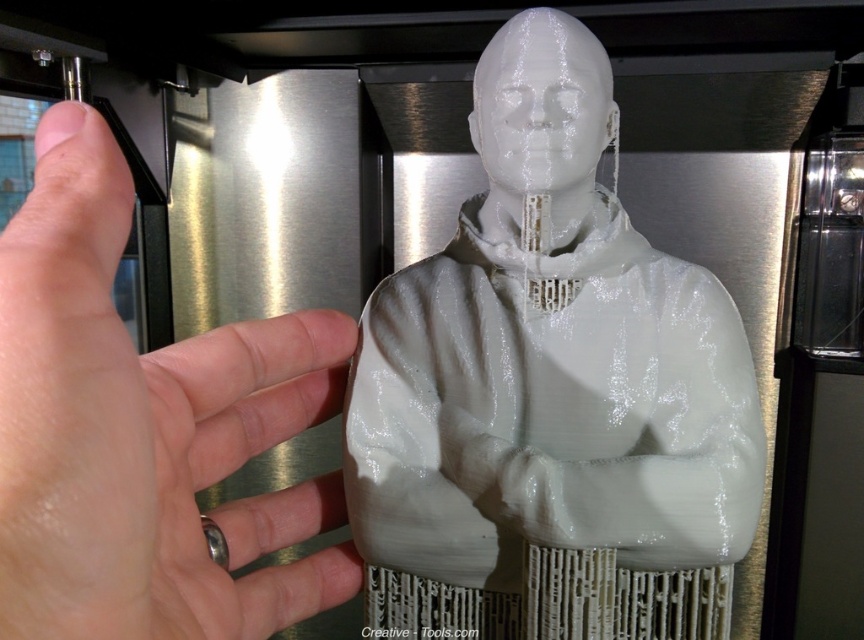
You are an art curator examining a 3D printed sculpture. The sculpture consists of a white glossy bust at center and a white matte hand at upper left. Which object has a greater width?

The white glossy bust at center has a greater width than the white matte hand at upper left.

You are an art curator examining the 3D printed sculpture. You notice the white glossy bust at center and the white matte hand at upper left. Which object is closer to you?

The white glossy bust at center is closer to you than the white matte hand at upper left.